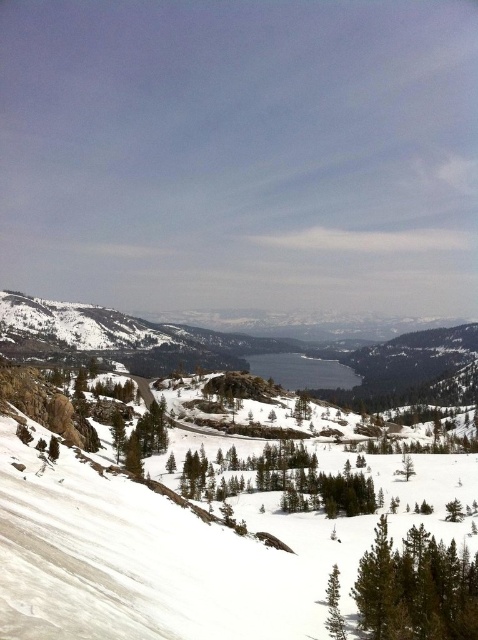
Question: Which point is farther to the camera?

Choices:
 (A) green matte tree at lower right
 (B) green textured pine tree at lower center

Answer: (B)

Question: Which of the following is the farthest from the observer?

Choices:
 (A) green matte tree at lower right
 (B) green textured pine tree at lower center

Answer: (B)

Question: Which object is farther from the camera taking this photo?

Choices:
 (A) green textured pine tree at lower center
 (B) green matte tree at lower right

Answer: (A)

Question: Is green matte tree at lower right behind green textured pine tree at lower center?

Choices:
 (A) yes
 (B) no

Answer: (B)

Question: Is green matte tree at lower right closer to the viewer compared to green textured pine tree at lower center?

Choices:
 (A) no
 (B) yes

Answer: (B)

Question: Is green matte tree at lower right smaller than green textured pine tree at lower center?

Choices:
 (A) no
 (B) yes

Answer: (A)